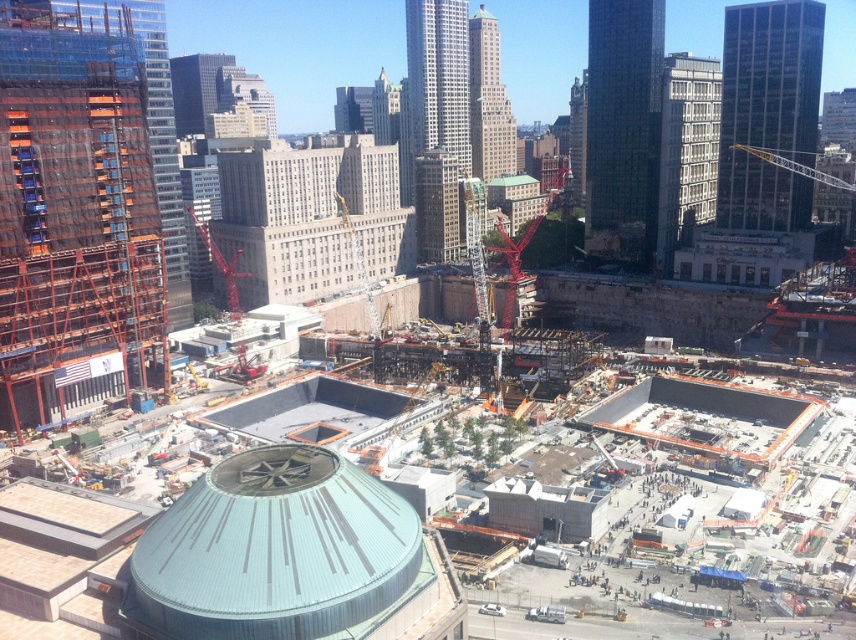
You are a construction worker standing at the edge of the construction site. You need to move a heavy beam from the dark glass skyscraper at upper right to the metallic construction crane at center. Which object should you approach first based on their positions?

You should approach the dark glass skyscraper at upper right first because it is closer to you than the metallic construction crane at center, so you can start moving the beam from the closer location.

What are the coordinates of the light gray concrete building at upper center in the image?

The coordinates of the light gray concrete building at upper center are at point (x=245, y=93).

You are an architect observing the construction site. You need to determine if the light gray concrete building at upper center can be seen from the top of the metallic construction crane at center. Based on their heights, what is your conclusion?

The light gray concrete building at upper center is not as tall as the metallic construction crane at center, so from the top of the metallic construction crane at center, the light gray concrete building at upper center would be visible since it is shorter.